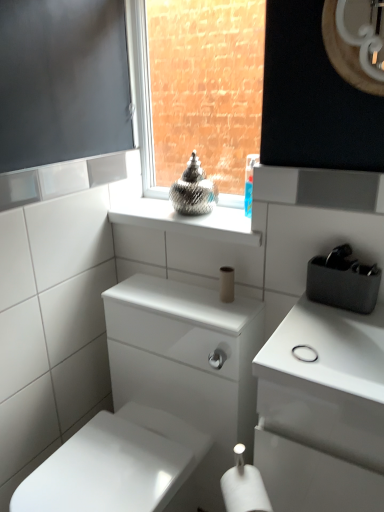
You are a GUI agent. You are given a task and a screenshot of the screen. Output one action in this format:
    pyautogui.click(x=<x>, y=<y>)
    Task: Click on the white glossy porcelain at center
    This screenshot has height=512, width=384.
    Given the screenshot: What is the action you would take?
    pos(160,404)

Describe the element at coordinates (160, 404) in the screenshot. The width and height of the screenshot is (384, 512). I see `white glossy porcelain at center` at that location.

You are a GUI agent. You are given a task and a screenshot of the screen. Output one action in this format:
    pyautogui.click(x=<x>, y=<y>)
    Task: Click on the white matte toilet paper at lower center, which appears as the first toilet paper when viewed from the front
    This screenshot has width=384, height=512.
    Given the screenshot: What is the action you would take?
    pyautogui.click(x=244, y=490)

Measure the distance between point (363, 17) and camera.

38.39 inches.

Describe the element at coordinates (142, 94) in the screenshot. I see `matte glass vase at center` at that location.

This screenshot has width=384, height=512. Describe the element at coordinates (188, 221) in the screenshot. I see `metallic silver vase at upper center` at that location.

The image size is (384, 512). I want to click on white glossy porcelain at center, so click(x=160, y=404).

Between matte glass vase at center and white matte toilet paper at center, acting as the first toilet paper starting from the top, which one has more height?

With more height is matte glass vase at center.

Considering the sizes of matte glass vase at center and white matte toilet paper at center, the second toilet paper in the front-to-back sequence, in the image, is matte glass vase at center wider or thinner than white matte toilet paper at center, the second toilet paper in the front-to-back sequence,?

Considering their sizes, matte glass vase at center looks slimmer than white matte toilet paper at center, the second toilet paper in the front-to-back sequence.

Which object is positioned more to the right, matte glass vase at center or white matte toilet paper at center, the second toilet paper in the front-to-back sequence?

From the viewer's perspective, white matte toilet paper at center, the second toilet paper in the front-to-back sequence, appears more on the right side.

The height and width of the screenshot is (512, 384). What are the coordinates of `window above the white matte toilet paper at center, acting as the first toilet paper starting from the top (from the image's perspective)` in the screenshot? It's located at (142, 94).

Who is shorter, white glossy porcelain at center or white matte toilet paper at center, marked as the 2th toilet paper in a bottom-to-top arrangement?

white matte toilet paper at center, marked as the 2th toilet paper in a bottom-to-top arrangement, is shorter.

Choose the correct answer: Is white glossy porcelain at center inside white matte toilet paper at center, marked as the 2th toilet paper in a bottom-to-top arrangement, or outside it?

white glossy porcelain at center exists outside the volume of white matte toilet paper at center, marked as the 2th toilet paper in a bottom-to-top arrangement.

Which is in front, white glossy porcelain at center or white matte toilet paper at center, acting as the first toilet paper starting from the top?

white glossy porcelain at center is more forward.

Does white glossy porcelain at center have a larger size compared to white matte toilet paper at center, marked as the 2th toilet paper in a bottom-to-top arrangement?

Indeed, white glossy porcelain at center has a larger size compared to white matte toilet paper at center, marked as the 2th toilet paper in a bottom-to-top arrangement.

Considering the relative positions of white glossy porcelain at center and glossy wood mirror at upper right in the image provided, is white glossy porcelain at center to the left of glossy wood mirror at upper right from the viewer's perspective?

Yes, white glossy porcelain at center is to the left of glossy wood mirror at upper right.

In the image, is white glossy porcelain at center positioned in front of or behind glossy wood mirror at upper right?

Visually, white glossy porcelain at center is located in front of glossy wood mirror at upper right.

Is white glossy porcelain at center looking in the opposite direction of glossy wood mirror at upper right?

That's not correct — white glossy porcelain at center is not looking away from glossy wood mirror at upper right.

Does point (92, 469) lie behind point (326, 3)?

Yes, point (92, 469) is behind point (326, 3).

Does point (151, 106) lie behind point (253, 471)?

That is True.

Could you measure the distance between matte glass vase at center and white matte toilet paper at lower center, which appears as the first toilet paper when viewed from the front?

matte glass vase at center is 1.15 meters from white matte toilet paper at lower center, which appears as the first toilet paper when viewed from the front.

Looking at this image, are matte glass vase at center and white matte toilet paper at lower center, marked as the second toilet paper in a top-to-bottom arrangement, beside each other?

No, matte glass vase at center is not making contact with white matte toilet paper at lower center, marked as the second toilet paper in a top-to-bottom arrangement.

Is matte glass vase at center facing away from white matte toilet paper at lower center, placed as the first toilet paper when sorted from bottom to top?

No, matte glass vase at center is not facing the opposite direction of white matte toilet paper at lower center, placed as the first toilet paper when sorted from bottom to top.

Is white matte toilet paper at center, marked as the 2th toilet paper in a bottom-to-top arrangement, not near glossy wood mirror at upper right?

white matte toilet paper at center, marked as the 2th toilet paper in a bottom-to-top arrangement, is near glossy wood mirror at upper right, not far away.

Does white matte toilet paper at center, the first toilet paper from the back, appear on the right side of glossy wood mirror at upper right?

No, white matte toilet paper at center, the first toilet paper from the back, is not to the right of glossy wood mirror at upper right.

Considering the sizes of objects glossy wood mirror at upper right and white matte toilet paper at center, the first toilet paper from the back, in the image provided, who is bigger, glossy wood mirror at upper right or white matte toilet paper at center, the first toilet paper from the back,?

glossy wood mirror at upper right is bigger.

Does glossy wood mirror at upper right come in front of white matte toilet paper at center, marked as the 2th toilet paper in a bottom-to-top arrangement?

That is True.

From the glossy wood mirror at upper right, count 2nd toilet papers backward and point to it. Please provide its 2D coordinates.

[(226, 284)]

What's the angular difference between glossy wood mirror at upper right and white matte toilet paper at center, the first toilet paper from the back,'s facing directions?

The angle between the facing direction of glossy wood mirror at upper right and the facing direction of white matte toilet paper at center, the first toilet paper from the back, is 0.588 degrees.

Is there a large distance between white glossy porcelain at center and white matte toilet paper at lower center, which appears as the first toilet paper when viewed from the front?

white glossy porcelain at center is near white matte toilet paper at lower center, which appears as the first toilet paper when viewed from the front, not far away.

Can you confirm if white glossy porcelain at center is thinner than white matte toilet paper at lower center, which appears as the first toilet paper when viewed from the front?

No, white glossy porcelain at center is not thinner than white matte toilet paper at lower center, which appears as the first toilet paper when viewed from the front.

Which is more to the left, white glossy porcelain at center or white matte toilet paper at lower center, marked as the second toilet paper in a top-to-bottom arrangement?

Positioned to the left is white glossy porcelain at center.

Locate an element on the screen. Image resolution: width=384 pixels, height=512 pixels. window lying in front of the white matte toilet paper at center, acting as the first toilet paper starting from the top is located at coordinates (142, 94).

Find the location of `porcelain to the left of white matte toilet paper at center, the first toilet paper from the back`. porcelain to the left of white matte toilet paper at center, the first toilet paper from the back is located at coordinates (160, 404).

Looking at the image, which one is located further to metallic silver vase at upper center, matte glass vase at center or white glossy porcelain at center?

Among the two, white glossy porcelain at center is located further to metallic silver vase at upper center.

When comparing their distances from white matte toilet paper at center, acting as the first toilet paper starting from the top, does white matte toilet paper at lower center, placed as the first toilet paper when sorted from bottom to top, or glossy wood mirror at upper right seem further?

glossy wood mirror at upper right lies further to white matte toilet paper at center, acting as the first toilet paper starting from the top, than the other object.

Which object lies further to the anchor point white glossy porcelain at center, white matte toilet paper at lower center, placed as the first toilet paper when sorted from bottom to top, or white matte toilet paper at center, marked as the 2th toilet paper in a bottom-to-top arrangement?

Based on the image, white matte toilet paper at lower center, placed as the first toilet paper when sorted from bottom to top, appears to be further to white glossy porcelain at center.

Looking at this image, considering their positions, is metallic silver vase at upper center positioned further to matte glass vase at center than white glossy porcelain at center?

Among the two, white glossy porcelain at center is located further to matte glass vase at center.

Looking at the image, which one is located closer to matte glass vase at center, white glossy porcelain at center or glossy wood mirror at upper right?

white glossy porcelain at center is positioned closer to the anchor matte glass vase at center.

Based on their spatial positions, is white matte toilet paper at center, marked as the 2th toilet paper in a bottom-to-top arrangement, or matte glass vase at center further from white matte toilet paper at lower center, which appears as the first toilet paper when viewed from the front?

Among the two, matte glass vase at center is located further to white matte toilet paper at lower center, which appears as the first toilet paper when viewed from the front.

Estimate the real-world distances between objects in this image. Which object is closer to metallic silver vase at upper center, white matte toilet paper at center, the first toilet paper from the back, or glossy wood mirror at upper right?

white matte toilet paper at center, the first toilet paper from the back.

Considering their positions, is glossy wood mirror at upper right positioned closer to white matte toilet paper at center, the second toilet paper in the front-to-back sequence, than metallic silver vase at upper center?

metallic silver vase at upper center is closer to white matte toilet paper at center, the second toilet paper in the front-to-back sequence.

Find the location of a particular element. Image resolution: width=384 pixels, height=512 pixels. toilet paper between glossy wood mirror at upper right and white matte toilet paper at lower center, marked as the second toilet paper in a top-to-bottom arrangement, in the up-down direction is located at coordinates (226, 284).

Identify the location of window between glossy wood mirror at upper right and metallic silver vase at upper center in the front-back direction. The width and height of the screenshot is (384, 512). (142, 94).

The image size is (384, 512). What are the coordinates of `window between glossy wood mirror at upper right and white glossy porcelain at center in the vertical direction` in the screenshot? It's located at (142, 94).

I want to click on window sill that lies between matte glass vase at center and white glossy porcelain at center from top to bottom, so click(x=188, y=221).